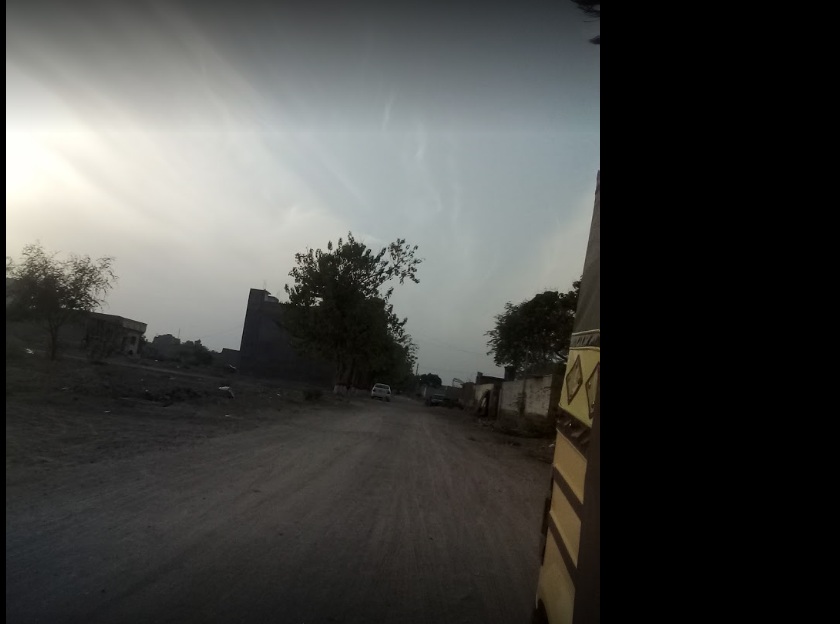
Find the location of a particular element. The width and height of the screenshot is (840, 624). wall is located at coordinates (508, 397).